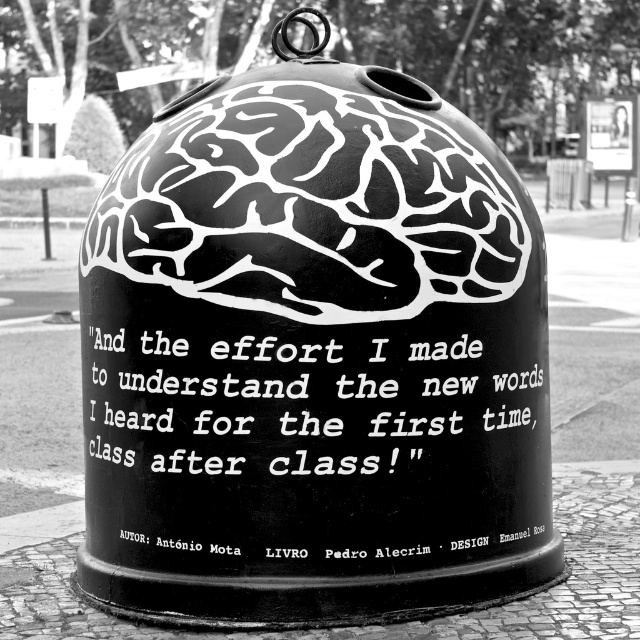
You are an art student analyzing the cylindrical object in the scene. You notice two points marked on the cylinder. Which of the two points, point (141, 364) or point (48, 230), is closer to you?

Point (141, 364) is closer to the viewer than point (48, 230).

You are a student who wants to read the text on the white matte text at center and the black metal pole at left. Which one is easier to read from a distance?

The white matte text at center has a larger size compared to the black metal pole at left, so it is easier to read from a distance.